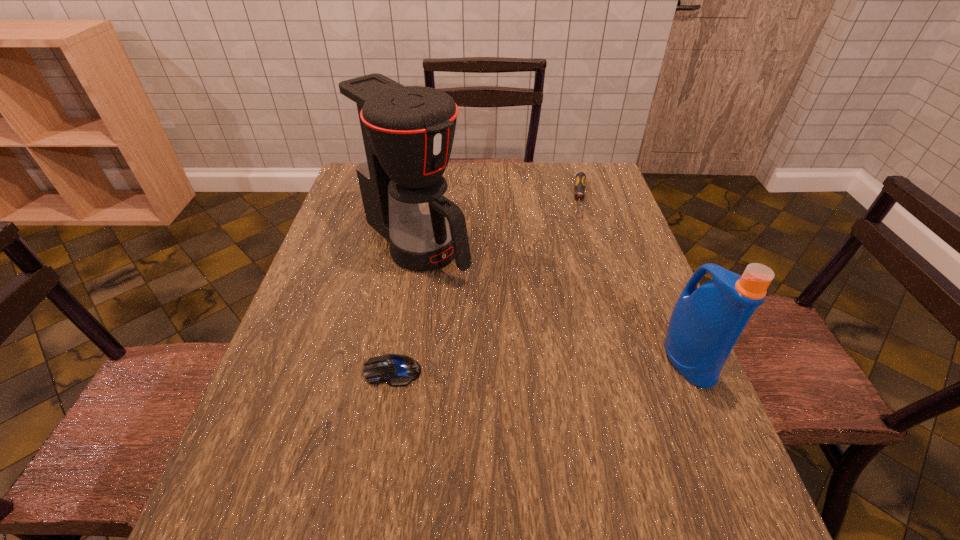
Where is `computer mouse`? computer mouse is located at coordinates (397, 370).

Image resolution: width=960 pixels, height=540 pixels. Find the location of `the rightmost object`. the rightmost object is located at coordinates (706, 322).

You are a GUI agent. You are given a task and a screenshot of the screen. Output one action in this format:
    pyautogui.click(x=<x>, y=<y>)
    Task: Click on the detergent
    This screenshot has height=540, width=960.
    Given the screenshot: What is the action you would take?
    pyautogui.click(x=706, y=322)

Where is `coffee maker`? The image size is (960, 540). coffee maker is located at coordinates (401, 137).

You are a GUI agent. You are given a task and a screenshot of the screen. Output one action in this format:
    pyautogui.click(x=<x>, y=<y>)
    Task: Click on the screwdriver
    
    Given the screenshot: What is the action you would take?
    pyautogui.click(x=580, y=183)

At what (x,y) coordinates should I click in order to perform the action: click on free location located 0.180m on the button side of the computer mouse. Please return your answer as a coordinate pair (x, y). The image size is (960, 540). Looking at the image, I should click on (279, 371).

Find the location of `vacant space situated on the button side of the computer mouse`. vacant space situated on the button side of the computer mouse is located at coordinates pyautogui.click(x=308, y=371).

The image size is (960, 540). What are the coordinates of `vacant space located 0.070m pour from the carafe of the tallest object` in the screenshot? It's located at (468, 292).

What are the coordinates of `free space located pour from the carafe of the tallest object` in the screenshot? It's located at (563, 374).

I want to click on vacant region located 0.230m pour from the carafe of the tallest object, so click(x=511, y=329).